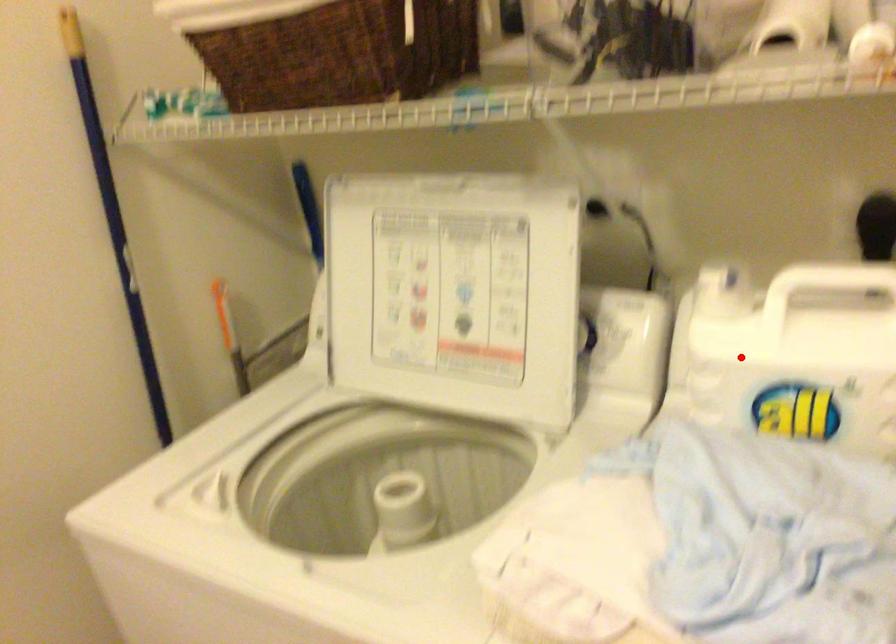
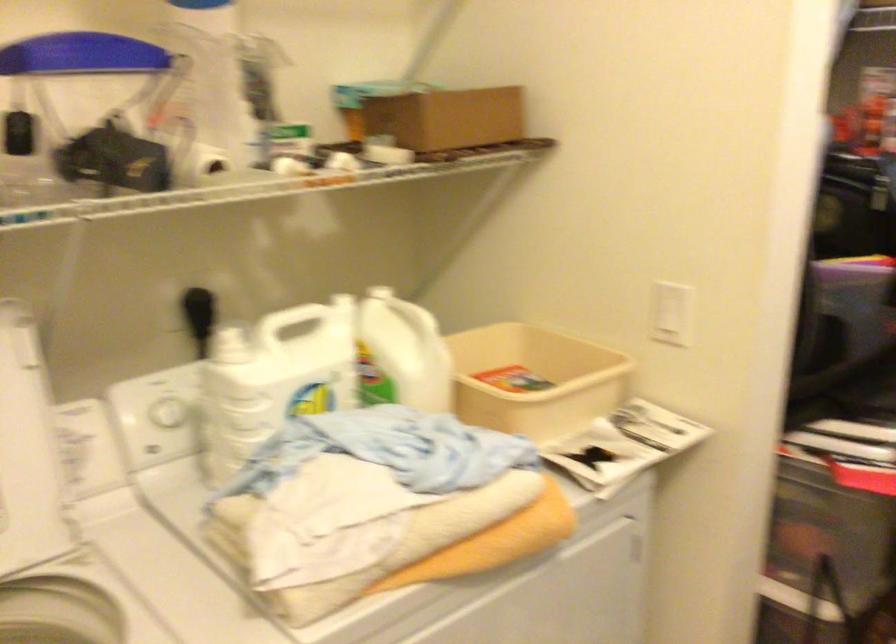
Question: I am providing you with two images of the same scene from different viewpoints. Given a red point in image1, look at the same physical point in image2. Is it:

Choices:
 (A) Closer to the viewpoint
 (B) Farther from the viewpoint

Answer: (B)